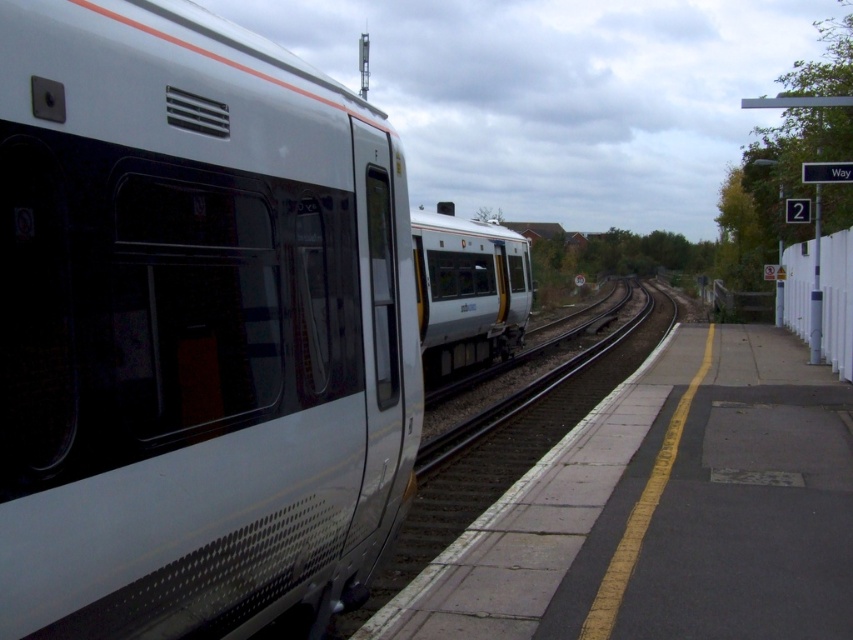
Question: Which point is farther to the camera?

Choices:
 (A) [505, 333]
 (B) [189, 493]
 (C) [492, 576]

Answer: (A)

Question: Which point is closer to the camera taking this photo?

Choices:
 (A) (68, 570)
 (B) (450, 349)
 (C) (593, 392)

Answer: (A)

Question: Does white matte train at left have a greater width compared to smooth metal train track at center?

Choices:
 (A) yes
 (B) no

Answer: (B)

Question: Which point is closer to the camera taking this photo?

Choices:
 (A) (425, 257)
 (B) (102, 378)

Answer: (B)

Question: Can you confirm if white matte train at left is wider than smooth metal train track at center?

Choices:
 (A) no
 (B) yes

Answer: (A)

Question: Can you confirm if white matte train at left is positioned below white glossy train at center?

Choices:
 (A) yes
 (B) no

Answer: (A)